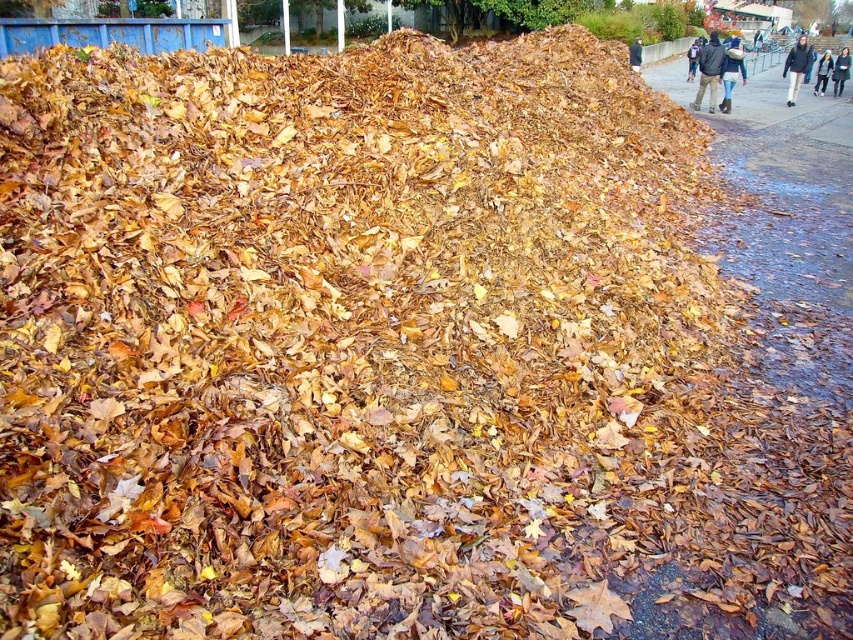
You are planning to borrow a jacket from either the dark blue jacket at upper right or the brown leather jacket at upper center. Which jacket has a bigger size?

The dark blue jacket at upper right has a larger size compared to the brown leather jacket at upper center.

You are standing on the paved pathway and want to hand a leaflet to the person wearing the dark gray sweater at upper right without disturbing the person in the brown leather jacket at upper center. Which person should you approach first?

You should approach the dark gray sweater at upper right first because the brown leather jacket at upper center is behind them, so reaching the dark gray sweater at upper right would not require moving past the brown leather jacket at upper center.